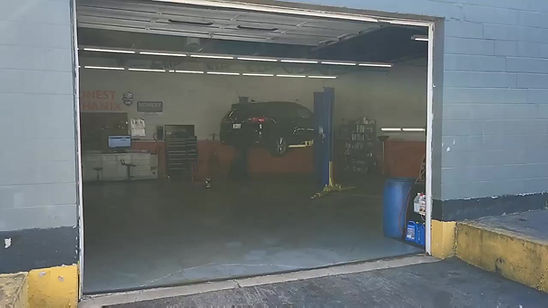
This screenshot has height=308, width=548. Find the location of `bottles`. bottles is located at coordinates (411, 232), (416, 203), (424, 207), (419, 233).